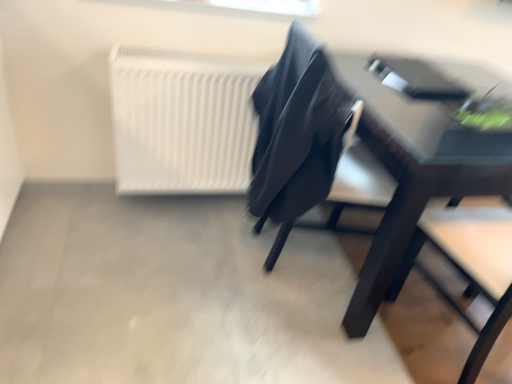
Question: Is matte black chair at center spatially inside matte black table at right, or outside of it?

Choices:
 (A) outside
 (B) inside

Answer: (A)

Question: From the image's perspective, is matte black chair at center positioned above or below matte black table at right?

Choices:
 (A) above
 (B) below

Answer: (A)

Question: Which object is the closest to the matte black chair at center?

Choices:
 (A) matte black table at right
 (B) white matte radiator at upper left

Answer: (A)

Question: Which object is positioned closest to the white matte radiator at upper left?

Choices:
 (A) matte black table at right
 (B) matte black chair at center

Answer: (B)